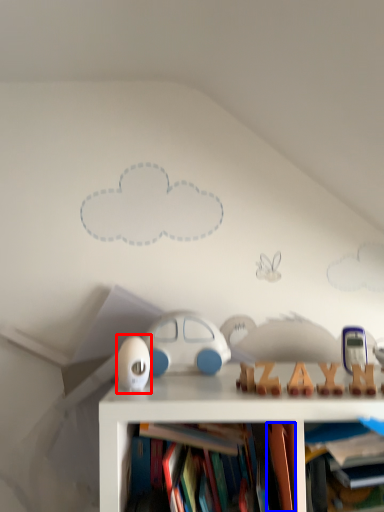
Question: Which point is closer to the camera, toy (highlighted by a red box) or book (highlighted by a blue box)?

Choices:
 (A) toy
 (B) book

Answer: (B)